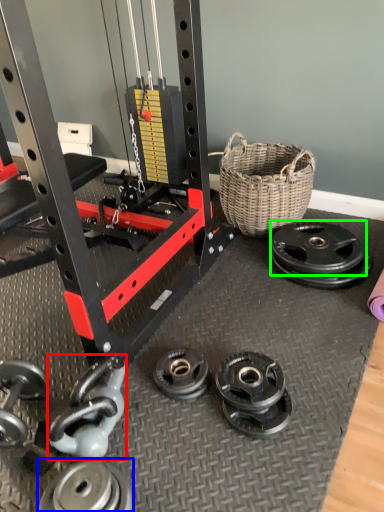
Question: Based on their relative distances, which object is farther from dumbbell (highlighted by a red box)? Choose from wheel (highlighted by a blue box) and wheel (highlighted by a green box).

Choices:
 (A) wheel
 (B) wheel

Answer: (B)